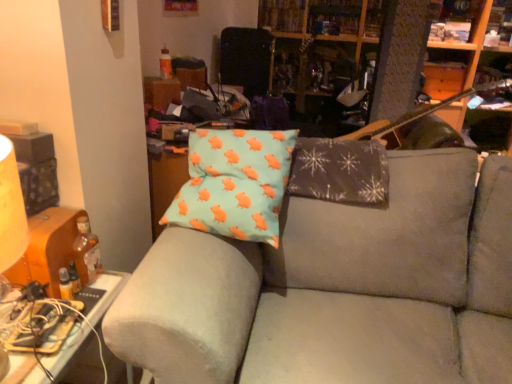
Question: Should I look upward or downward to see suede couch at center?

Choices:
 (A) up
 (B) down

Answer: (B)